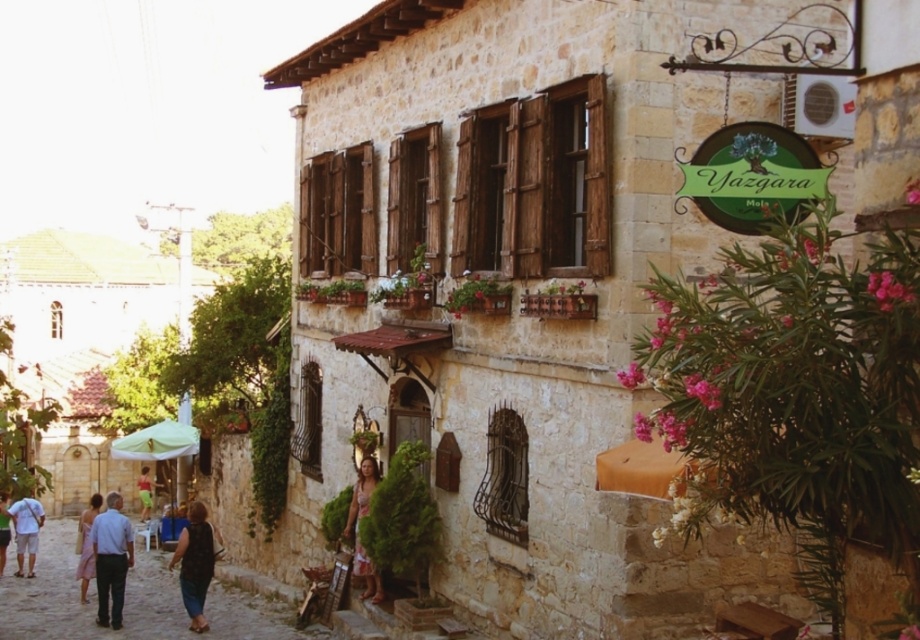
You are a tailor in the village and need to determine which clothing item requires more fabric. You have the light blue jeans at lower left and the matte pink shirt at center. Based on their sizes, which one would need more fabric?

The light blue jeans at lower left is larger in size than the matte pink shirt at center, so it would require more fabric.

You are a traveler standing in front of the village building and you see the green fabric umbrella at lower left and the light blue jeans at lower left. Which object is positioned higher from the ground?

The green fabric umbrella at lower left is above light blue jeans at lower left, so the green fabric umbrella at lower left is higher from the ground.

You are a tourist visiting this European village and notice both the green fabric umbrella at lower left and the light blue jeans at lower left. From your vantage point, which object is closer to you?

The green fabric umbrella at lower left is closer to you because the light blue jeans at lower left is behind it.